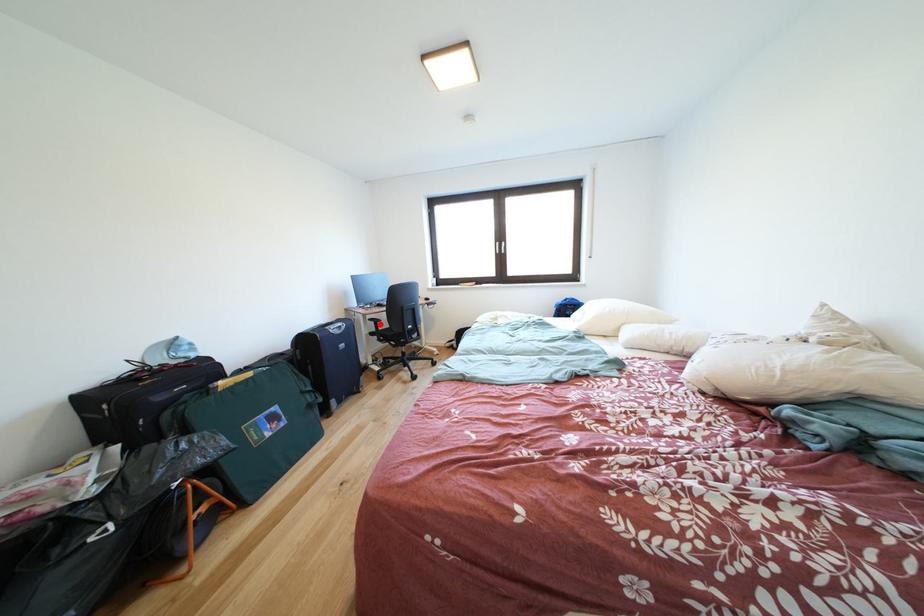
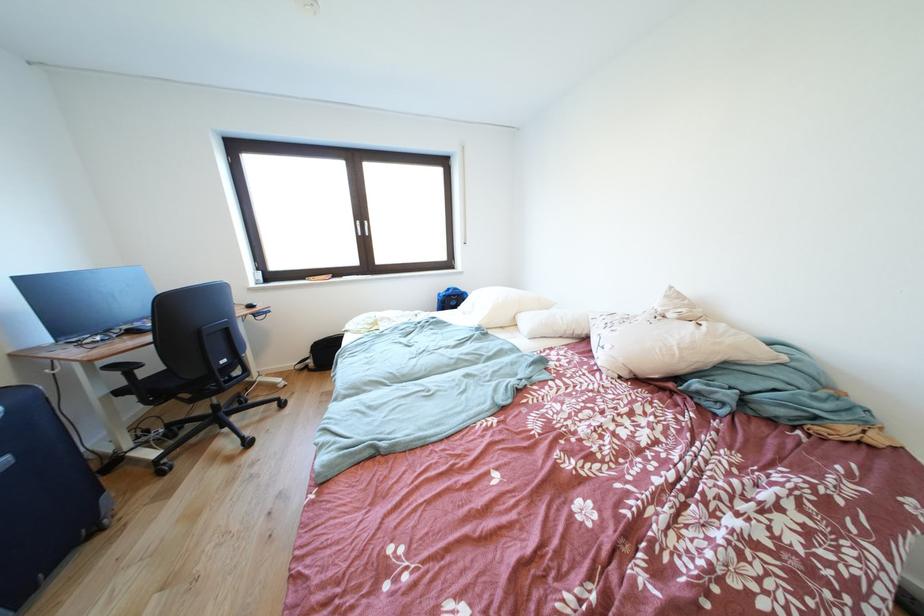
Find the pixel in the second image that matches the highlighted location in the first image.

(120, 371)